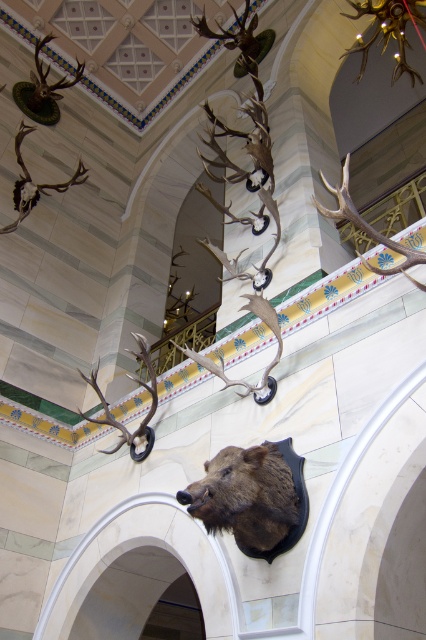
Is the position of white marble archway at center more distant than that of shiny brown antlers at left?

No, it is not.

Can you confirm if white marble archway at center is wider than shiny brown antlers at left?

Yes, white marble archway at center is wider than shiny brown antlers at left.

Identify the location of white marble archway at center. (89, 544).

Is brown furry head at center closer to camera compared to shiny brown antlers at upper left?

Yes, brown furry head at center is closer to the viewer.

Does point (264, 540) come in front of point (57, 81)?

Yes, it is in front of point (57, 81).

What do you see at coordinates (253, 497) in the screenshot?
I see `brown furry head at center` at bounding box center [253, 497].

This screenshot has width=426, height=640. In order to click on brown furry head at center in this screenshot , I will do `click(253, 497)`.

This screenshot has height=640, width=426. Describe the element at coordinates (89, 544) in the screenshot. I see `white marble archway at center` at that location.

Is white marble archway at center to the left of shiny brown antlers at center from the viewer's perspective?

Yes, white marble archway at center is to the left of shiny brown antlers at center.

Is point (40, 612) farther from viewer compared to point (370, 237)?

Yes, point (40, 612) is farther from viewer.

Locate an element on the screen. white marble archway at center is located at coordinates (89, 544).